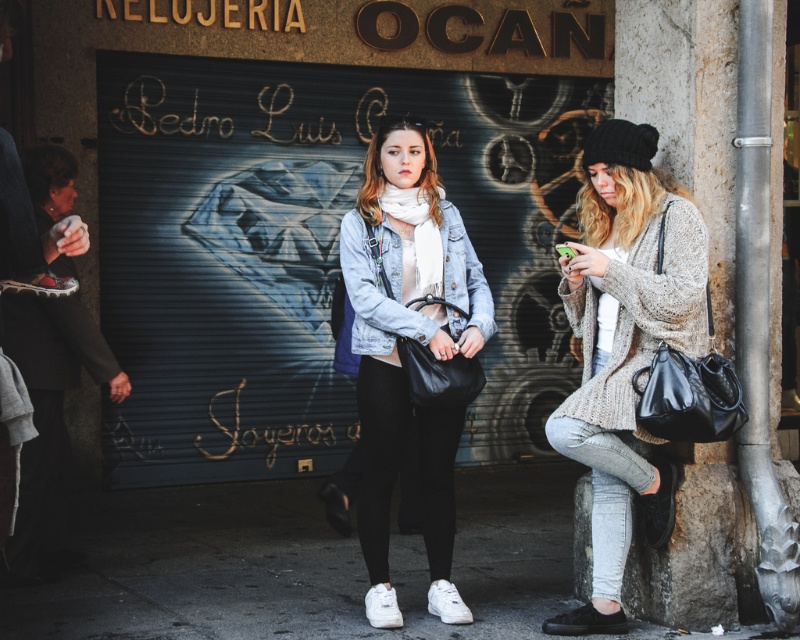
You are a fashion designer observing two people on a street. You see a knitted beige sweater at right and a denim jacket at center. Which clothing item is located to the right of the other?

The knitted beige sweater at right is positioned on the right side of the denim jacket at center, so the knitted beige sweater at right is to the right of the denim jacket at center.

Consider the image. You are a fashion blogger who wants to take a photo of the knitted beige sweater at right and denim jacket at center in the scene. From the perspective of someone facing the scene, which clothing item is positioned lower on the body?

The knitted beige sweater at right is located below the denim jacket at center, so the knitted beige sweater at right is positioned lower on the body.

You are a photographer trying to capture both the knitted beige sweater at right and the denim jacket at center in a single frame. Which object should you focus on first to ensure both are in the shot?

The knitted beige sweater at right is in front of the denim jacket at center, so you should focus on the denim jacket at center first to ensure both are in the shot.